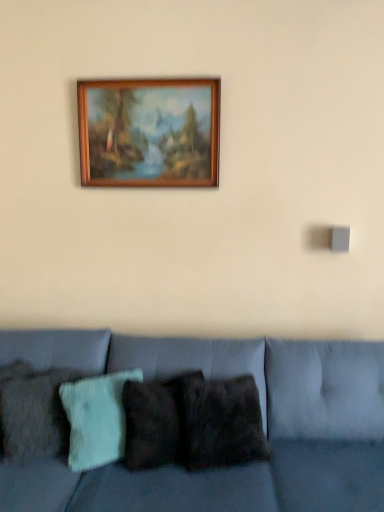
Question: From a real-world perspective, is textured woolen pillow at left, positioned as the 1th pillow in left-to-right order, physically located above or below velvet blue couch at lower center?

Choices:
 (A) below
 (B) above

Answer: (B)

Question: Would you say textured woolen pillow at left, acting as the third pillow starting from the right, is to the left or to the right of velvet blue couch at lower center in the picture?

Choices:
 (A) left
 (B) right

Answer: (A)

Question: Estimate the real-world distances between objects in this image. Which object is closer to the dark brown textured pillow at center, placed as the 1th pillow when sorted from right to left?

Choices:
 (A) textured woolen pillow at left, positioned as the 1th pillow in left-to-right order
 (B) textured teal pillow at center, the 2th pillow in the right-to-left sequence
 (C) velvet blue couch at lower center
 (D) wooden picture frame at upper center

Answer: (C)

Question: Which object is positioned closest to the textured teal pillow at center, the 2th pillow in the right-to-left sequence?

Choices:
 (A) velvet blue couch at lower center
 (B) textured woolen pillow at left, positioned as the 1th pillow in left-to-right order
 (C) wooden picture frame at upper center
 (D) dark brown textured pillow at center, placed as the 1th pillow when sorted from right to left

Answer: (B)